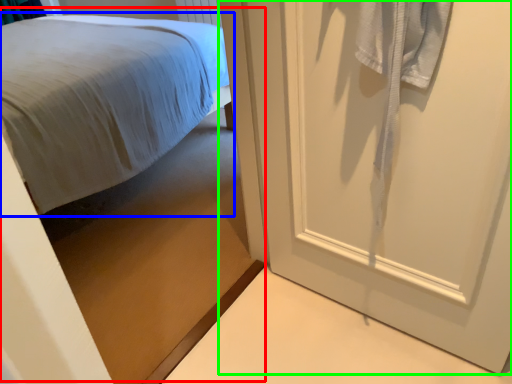
Question: Considering the real-world distances, which object is farthest from bed (highlighted by a red box)? bed (highlighted by a blue box) or door (highlighted by a green box)?

Choices:
 (A) bed
 (B) door

Answer: (B)